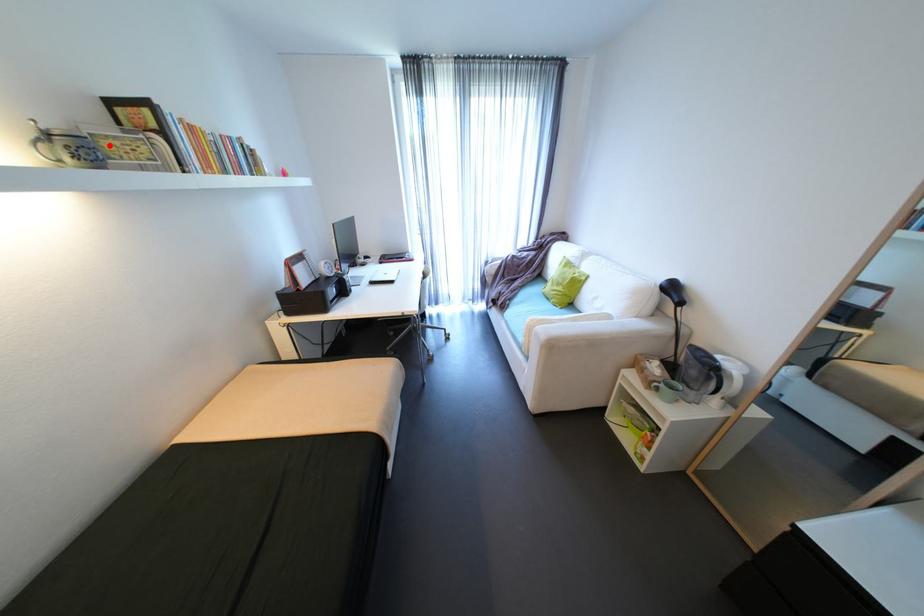
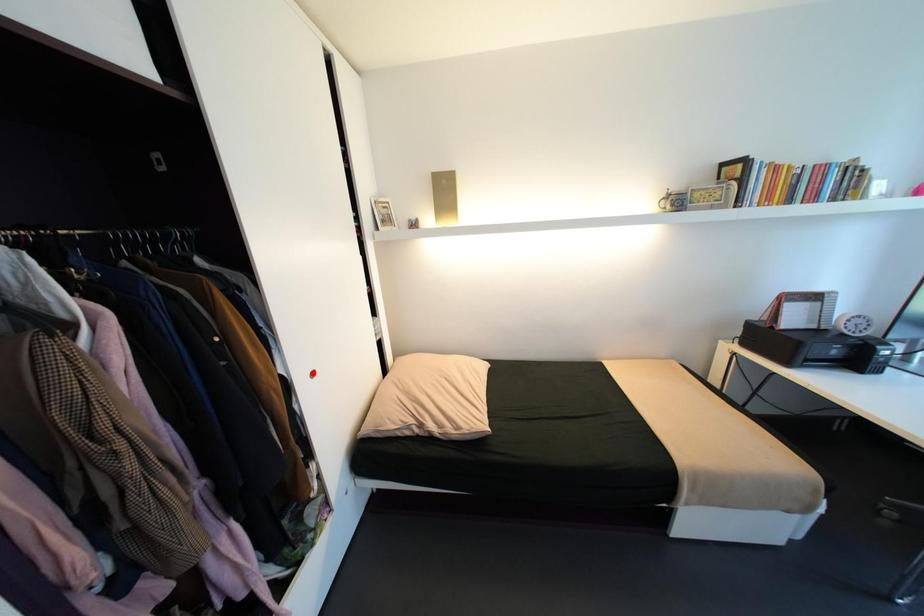
I am providing you with two images of the same scene from different viewpoints. A red point is marked on the first image and another point is marked on the second image. Does the point marked in image1 correspond to the same location as the one in image2?

No